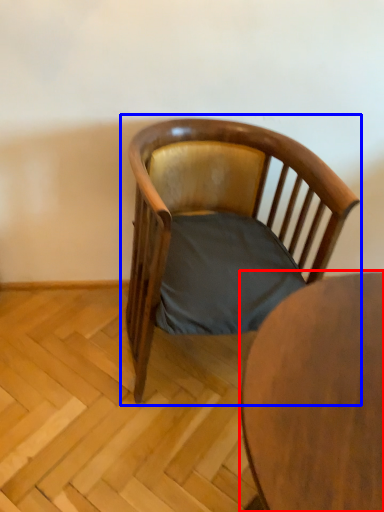
Question: Which point is further to the camera, table (highlighted by a red box) or chair (highlighted by a blue box)?

Choices:
 (A) table
 (B) chair

Answer: (B)